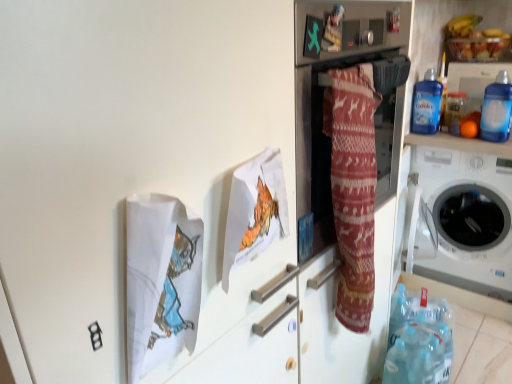
Question: From the image's perspective, is blue plastic bottle at upper right, which ranks as the first bottle in back-to-front order, located above blue plastic bottle at upper right, marked as the third bottle in a back-to-front arrangement?

Choices:
 (A) yes
 (B) no

Answer: (A)

Question: From the image's perspective, is blue plastic bottle at upper right, the 4th bottle from the front, below blue plastic bottle at upper right, which appears as the 2th bottle when viewed from the front?

Choices:
 (A) yes
 (B) no

Answer: (B)

Question: Does blue plastic bottle at upper right, which ranks as the first bottle in back-to-front order, have a larger size compared to blue plastic bottle at upper right, marked as the third bottle in a back-to-front arrangement?

Choices:
 (A) yes
 (B) no

Answer: (B)

Question: Can you confirm if blue plastic bottle at upper right, the 4th bottle from the front, is shorter than blue plastic bottle at upper right, which appears as the 2th bottle when viewed from the front?

Choices:
 (A) no
 (B) yes

Answer: (A)

Question: From a real-world perspective, is blue plastic bottle at upper right, which ranks as the first bottle in back-to-front order, physically above blue plastic bottle at upper right, marked as the third bottle in a back-to-front arrangement?

Choices:
 (A) no
 (B) yes

Answer: (B)

Question: Does blue plastic bottle at upper right, which ranks as the first bottle in back-to-front order, have a greater height compared to blue plastic bottle at upper right, marked as the third bottle in a back-to-front arrangement?

Choices:
 (A) no
 (B) yes

Answer: (B)

Question: From the image's perspective, would you say blue plastic bottle at upper right, marked as the third bottle in a back-to-front arrangement, is shown under blue plastic bottle at upper right, the 1th bottle viewed from the front?

Choices:
 (A) no
 (B) yes

Answer: (A)

Question: Is blue plastic bottle at upper right, which appears as the 2th bottle when viewed from the front, positioned beyond the bounds of blue plastic bottle at upper right, which is the 4th bottle from back to front?

Choices:
 (A) no
 (B) yes

Answer: (B)

Question: Considering the relative positions of blue plastic bottle at upper right, marked as the third bottle in a back-to-front arrangement, and blue plastic bottle at upper right, the 1th bottle viewed from the front, in the image provided, is blue plastic bottle at upper right, marked as the third bottle in a back-to-front arrangement, to the right of blue plastic bottle at upper right, the 1th bottle viewed from the front, from the viewer's perspective?

Choices:
 (A) no
 (B) yes

Answer: (A)

Question: Is blue plastic bottle at upper right, marked as the third bottle in a back-to-front arrangement, positioned before blue plastic bottle at upper right, the 1th bottle viewed from the front?

Choices:
 (A) no
 (B) yes

Answer: (A)

Question: Considering the relative sizes of blue plastic bottle at upper right, which appears as the 2th bottle when viewed from the front, and blue plastic bottle at upper right, which is the 4th bottle from back to front, in the image provided, is blue plastic bottle at upper right, which appears as the 2th bottle when viewed from the front, shorter than blue plastic bottle at upper right, which is the 4th bottle from back to front,?

Choices:
 (A) no
 (B) yes

Answer: (A)

Question: Is there a large distance between blue plastic bottle at upper right, marked as the third bottle in a back-to-front arrangement, and blue plastic bottle at upper right, the 1th bottle viewed from the front?

Choices:
 (A) yes
 (B) no

Answer: (B)

Question: Is orange matte at upper right facing away from blue plastic bottle at upper right, marked as the third bottle in a back-to-front arrangement?

Choices:
 (A) no
 (B) yes

Answer: (A)